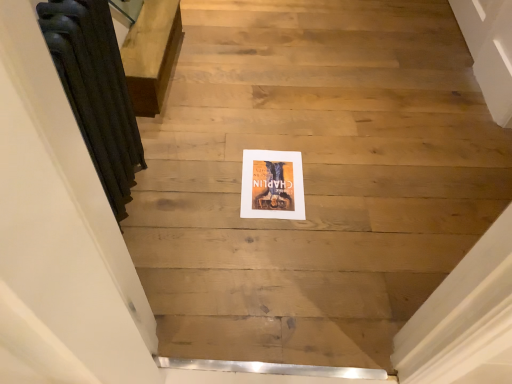
Where is `free location above white matte picture frame at center (from a real-world perspective)`? free location above white matte picture frame at center (from a real-world perspective) is located at coordinates (269, 177).